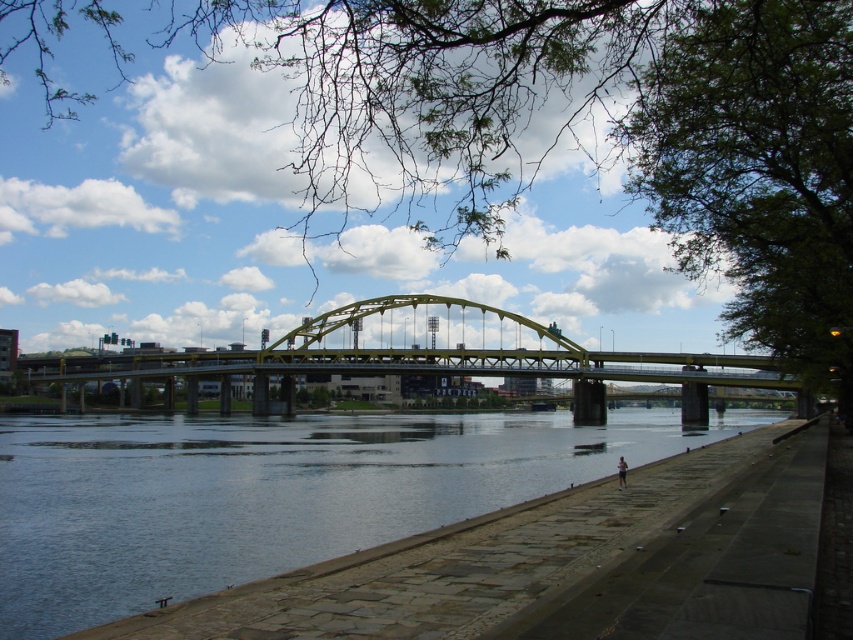
Does clear water at lower left appear under yellow metallic bridge at center?

Indeed, clear water at lower left is positioned under yellow metallic bridge at center.

Can you confirm if clear water at lower left is bigger than yellow metallic bridge at center?

Incorrect, clear water at lower left is not larger than yellow metallic bridge at center.

Between point (331, 499) and point (445, 317), which one is positioned in front?

Point (331, 499) is more forward.

The width and height of the screenshot is (853, 640). I want to click on clear water at lower left, so click(267, 493).